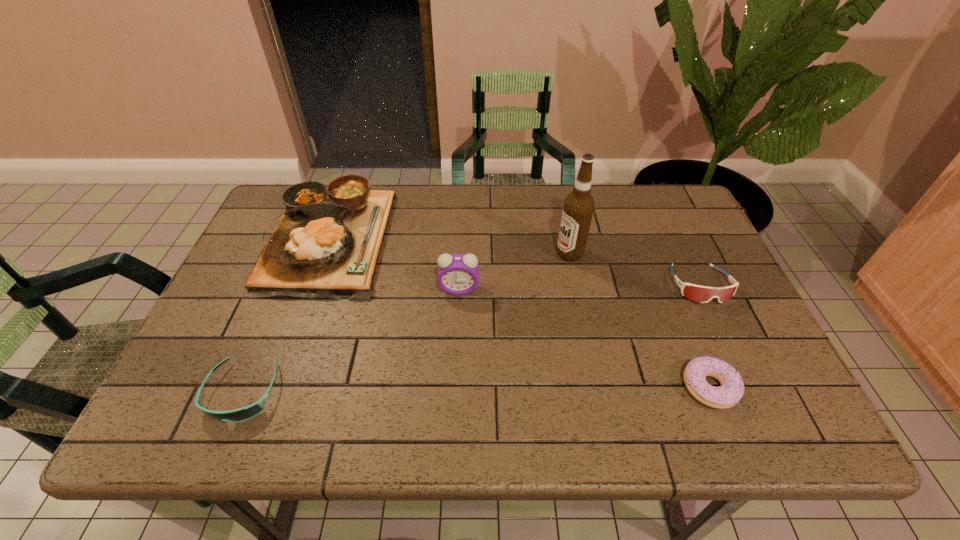
You are a GUI agent. You are given a task and a screenshot of the screen. Output one action in this format:
    pyautogui.click(x=<x>, y=<y>)
    Task: Click on the alcohol
    The image size is (960, 540).
    Given the screenshot: What is the action you would take?
    pyautogui.click(x=578, y=207)

The width and height of the screenshot is (960, 540). What are the coordinates of `the fourth object from left to right` in the screenshot? It's located at (578, 207).

Locate an element on the screen. This screenshot has height=540, width=960. alarm clock is located at coordinates (458, 274).

Image resolution: width=960 pixels, height=540 pixels. I want to click on the second tallest object, so click(458, 274).

Where is `the third tallest object`? This screenshot has width=960, height=540. the third tallest object is located at coordinates (326, 245).

The image size is (960, 540). I want to click on goggles, so click(702, 294).

The height and width of the screenshot is (540, 960). Find the location of `sunglasses`. sunglasses is located at coordinates (241, 414).

Where is `doughnut`? This screenshot has height=540, width=960. doughnut is located at coordinates (727, 395).

Find the location of a particular element. vacant space located on the label of the fourth object from left to right is located at coordinates (519, 253).

Where is `vacant space located 0.100m on the label of the fourth object from left to right`? This screenshot has width=960, height=540. vacant space located 0.100m on the label of the fourth object from left to right is located at coordinates (519, 253).